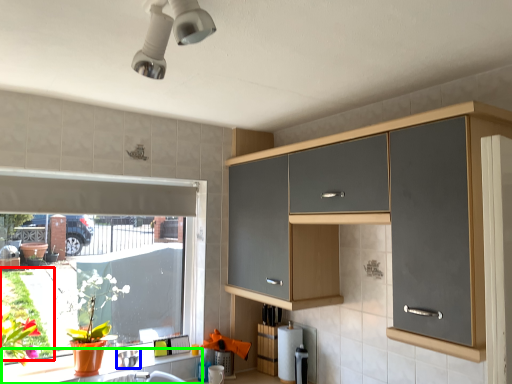
Question: Considering the real-world distances, which object is closest to plant (highlighted by a red box)? appliance (highlighted by a blue box) or counter (highlighted by a green box).

Choices:
 (A) appliance
 (B) counter

Answer: (B)